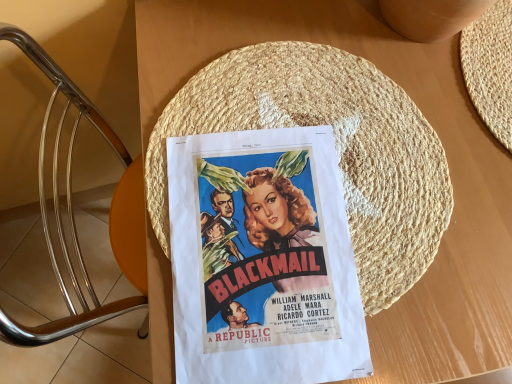
Locate an element on the screen. free point behind matte paper poster at center is located at coordinates (302, 82).